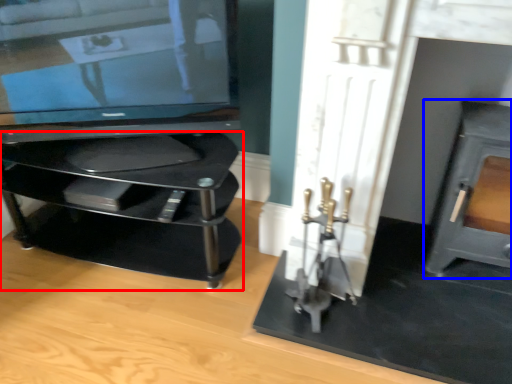
Question: Among these objects, which one is nearest to the camera, furniture (highlighted by a red box) or fireplace (highlighted by a blue box)?

Choices:
 (A) furniture
 (B) fireplace

Answer: (B)